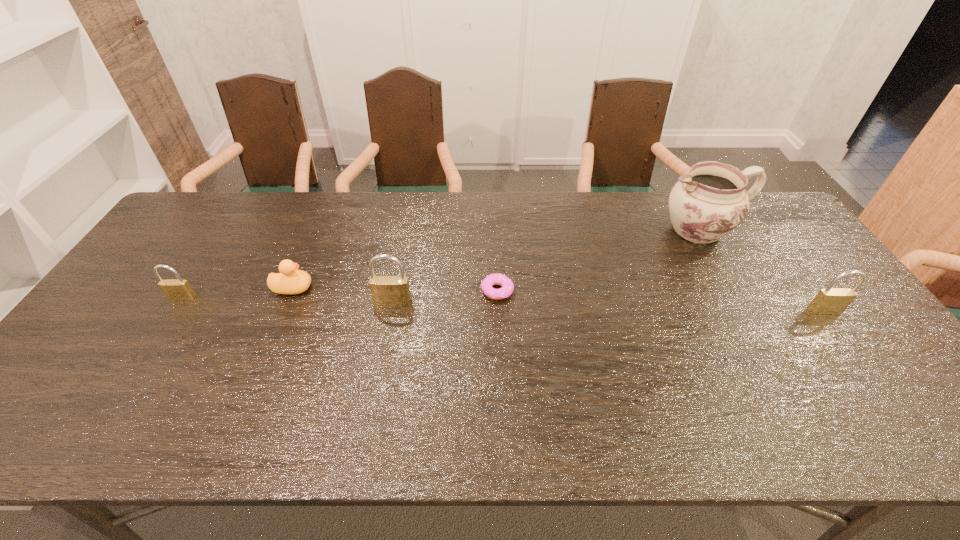
The width and height of the screenshot is (960, 540). In order to click on the shortest padlock in this screenshot , I will do `click(174, 289)`.

Identify the location of the leftmost object. (174, 289).

Image resolution: width=960 pixels, height=540 pixels. I want to click on the second padlock from right to left, so click(x=385, y=290).

You are a GUI agent. You are given a task and a screenshot of the screen. Output one action in this format:
    pyautogui.click(x=<x>, y=<y>)
    Task: Click on the third tallest object
    
    Given the screenshot: What is the action you would take?
    pyautogui.click(x=831, y=300)

This screenshot has height=540, width=960. Identify the location of the second tallest padlock. point(831,300).

You are a GUI agent. You are given a task and a screenshot of the screen. Output one action in this format:
    pyautogui.click(x=<x>, y=<y>)
    Task: Click on the fifth object from left to right
    The width and height of the screenshot is (960, 540).
    Given the screenshot: What is the action you would take?
    pyautogui.click(x=705, y=205)

The image size is (960, 540). In order to click on pitcher in this screenshot , I will do `click(705, 205)`.

This screenshot has height=540, width=960. I want to click on the third object from right to left, so click(507, 285).

Image resolution: width=960 pixels, height=540 pixels. Identify the location of doughnut. (x=507, y=285).

The height and width of the screenshot is (540, 960). I want to click on the fifth tallest object, so click(290, 281).